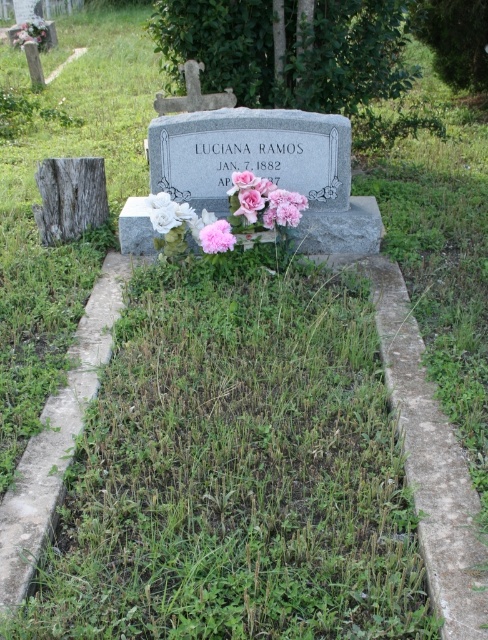
Question: Where is smooth gray stone at center located in relation to pink matte flower at center in the image?

Choices:
 (A) right
 (B) left

Answer: (B)

Question: Which of these objects is positioned farthest from the pink matte flowers at center?

Choices:
 (A) pink matte flower at center
 (B) white matte flower at lower left

Answer: (B)

Question: Among these objects, which one is farthest from the camera?

Choices:
 (A) white matte flower at lower left
 (B) pink matte flowers at center
 (C) pink matte flower at center
 (D) smooth gray stone at center

Answer: (D)

Question: Which point appears closest to the camera in this image?

Choices:
 (A) coord(237,192)
 (B) coord(164,195)
 (C) coord(207,236)

Answer: (C)

Question: In this image, where is smooth gray stone at center located relative to white matte flower at lower left?

Choices:
 (A) right
 (B) left

Answer: (B)

Question: Does pink matte flowers at center appear under pink matte flower at center?

Choices:
 (A) no
 (B) yes

Answer: (A)